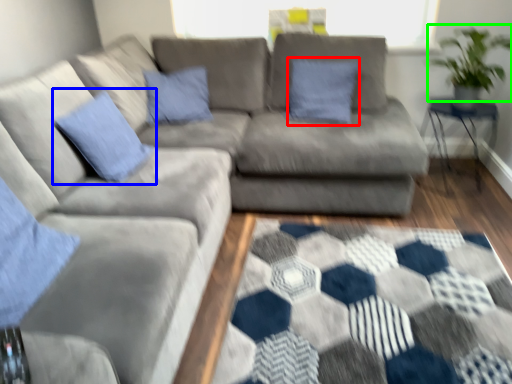
Question: Considering the real-world distances, which object is farthest from pillow (highlighted by a red box)? pillow (highlighted by a blue box) or plant (highlighted by a green box)?

Choices:
 (A) pillow
 (B) plant

Answer: (A)